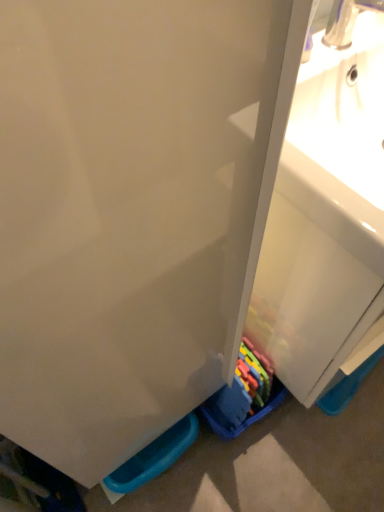
Describe the element at coordinates (346, 21) in the screenshot. This screenshot has height=512, width=384. I see `satin nickel faucet at upper right` at that location.

In order to click on satin nickel faucet at upper right in this screenshot , I will do `click(346, 21)`.

You are a GUI agent. You are given a task and a screenshot of the screen. Output one action in this format:
    pyautogui.click(x=<x>, y=<y>)
    Task: Click on the satin nickel faucet at upper right
    Image resolution: width=384 pixels, height=512 pixels.
    Given the screenshot: What is the action you would take?
    pyautogui.click(x=346, y=21)